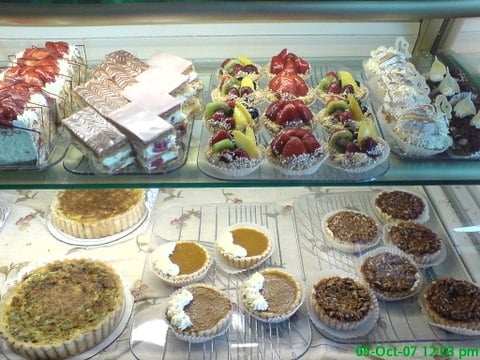
This screenshot has height=360, width=480. Find the location of `glass plates`. glass plates is located at coordinates (302, 342), (390, 334), (212, 171), (170, 165), (59, 148), (387, 140).